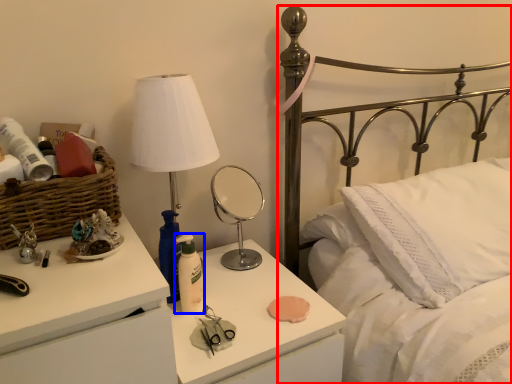
Question: Which object is closer to the camera taking this photo, bed (highlighted by a red box) or bottle (highlighted by a blue box)?

Choices:
 (A) bed
 (B) bottle

Answer: (A)